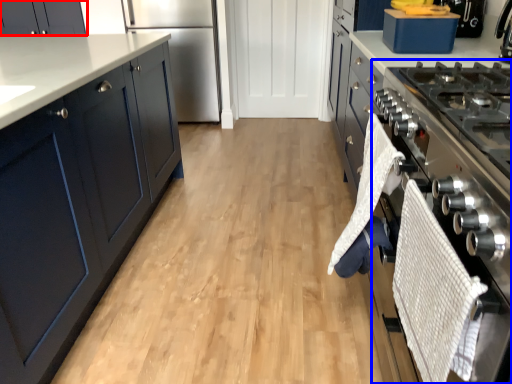
Question: Among these objects, which one is farthest to the camera, cabinetry (highlighted by a red box) or oven (highlighted by a blue box)?

Choices:
 (A) cabinetry
 (B) oven

Answer: (A)